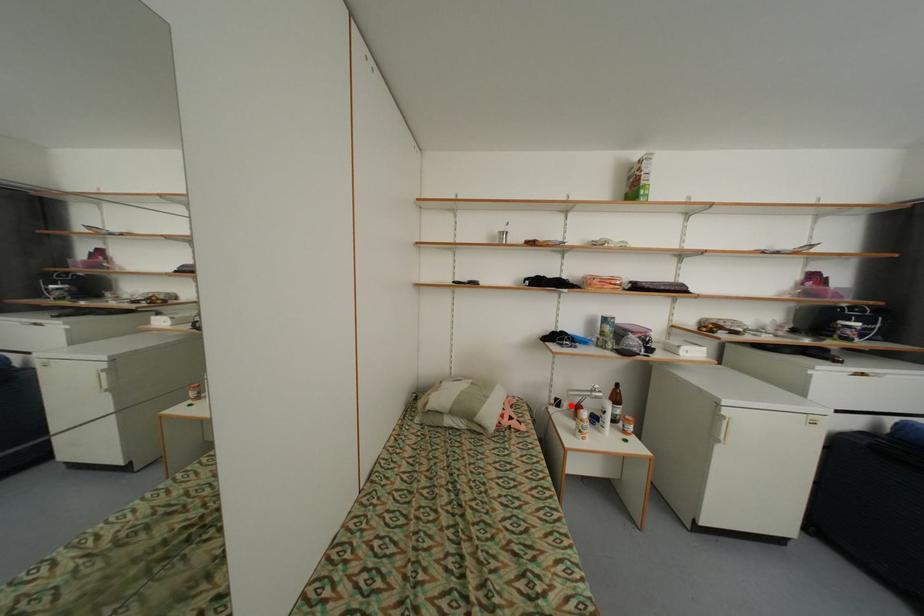
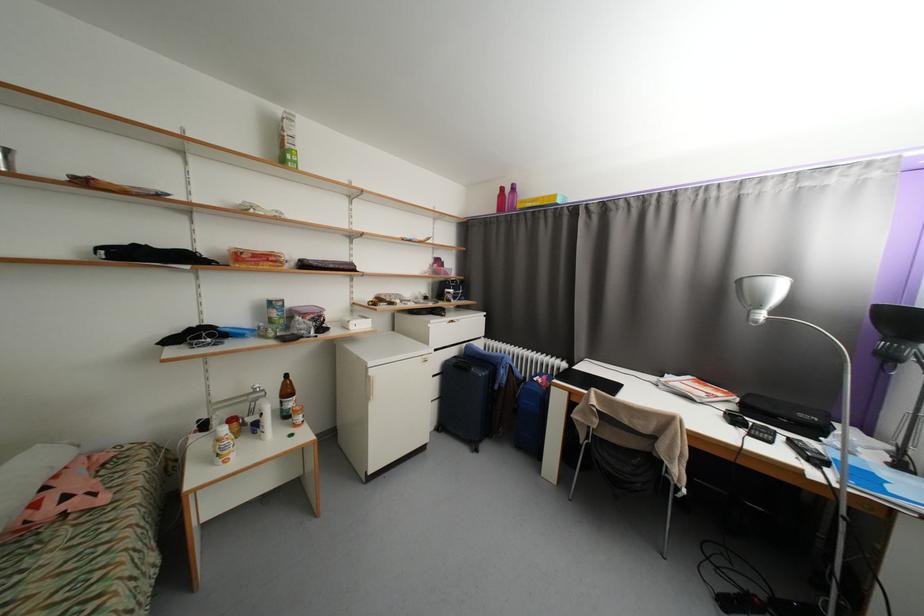
In the second image, find the point that corresponds to the highlighted location in the first image.

(222, 424)